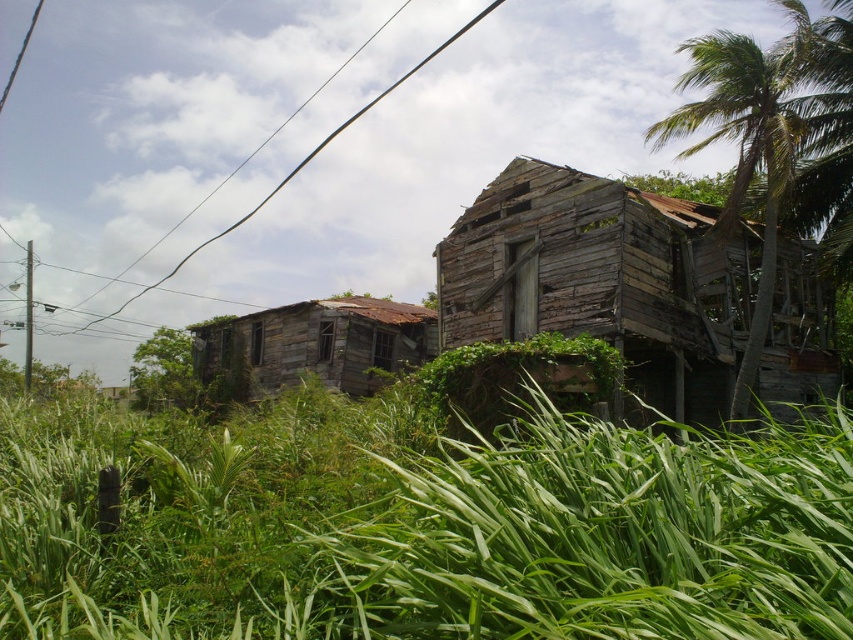
Does weathered wood hut at center appear under rusty wood hut at center-left?

Yes.

Which is behind, point (781, 300) or point (387, 371)?

Point (387, 371)

Identify the location of weathered wood hut at center. (604, 280).

Where is `weathered wood hut at center`? weathered wood hut at center is located at coordinates (604, 280).

Is weathered wood hut at center above black wire at upper center?

Incorrect, weathered wood hut at center is not positioned above black wire at upper center.

Measure the distance between weathered wood hut at center and camera.

weathered wood hut at center is 9.24 meters from camera.

The width and height of the screenshot is (853, 640). Find the location of `weathered wood hut at center`. weathered wood hut at center is located at coordinates (604, 280).

Is point (296, 310) more distant than point (146, 291)?

That is False.

Does rusty wood hut at center-left appear over black wire at upper center?

Incorrect, rusty wood hut at center-left is not positioned above black wire at upper center.

Who is more forward, (245, 355) or (325, 144)?

Point (245, 355)

Image resolution: width=853 pixels, height=640 pixels. What are the coordinates of `rusty wood hut at center-left` in the screenshot? It's located at (312, 346).